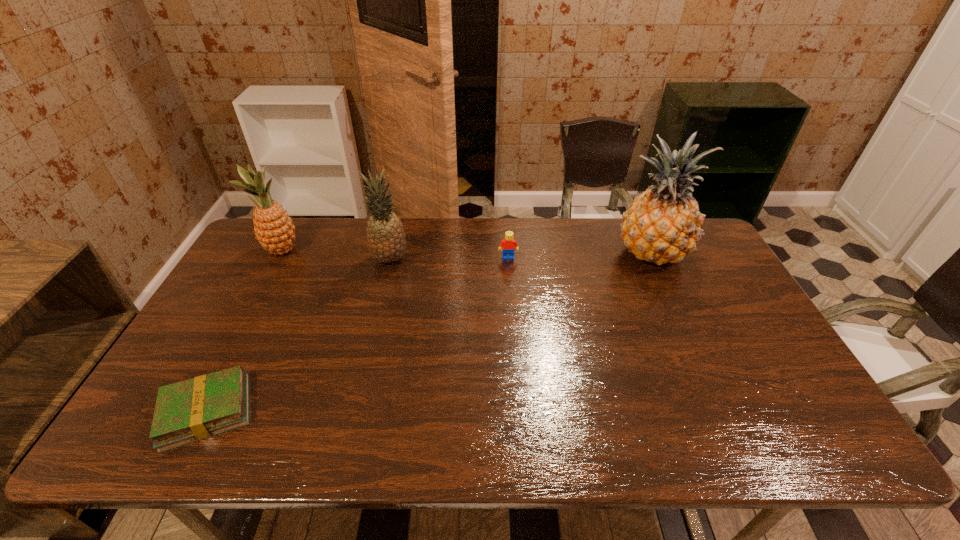
Locate an element on the screen. vacant space that is in between the fourth tallest object and the rightmost pineapple is located at coordinates (580, 255).

At what (x,y) coordinates should I click in order to perform the action: click on free point between the second pineapple from right to left and the nearest object. Please return your answer as a coordinate pair (x, y). Image resolution: width=960 pixels, height=540 pixels. Looking at the image, I should click on (299, 335).

The height and width of the screenshot is (540, 960). Identify the location of free space between the fourth tallest object and the second pineapple from left to right. (449, 258).

Identify the location of free point between the third object from right to left and the nearest object. The width and height of the screenshot is (960, 540). (299, 335).

Identify the location of free space between the shortest object and the leftmost pineapple. The image size is (960, 540). (245, 330).

The width and height of the screenshot is (960, 540). I want to click on vacant space that's between the book and the second shortest object, so click(357, 334).

This screenshot has height=540, width=960. Identify the location of object that is the closest one to the leftmost pineapple. (386, 239).

Identify which object is the fourth nearest to the nearest object. Please provide its 2D coordinates. Your answer should be formatted as a tuple, i.e. [(x, y)], where the tuple contains the x and y coordinates of a point satisfying the conditions above.

[(663, 224)]

The image size is (960, 540). Find the location of `pineapple that is the closest to the Lego`. pineapple that is the closest to the Lego is located at coordinates (386, 239).

The height and width of the screenshot is (540, 960). Identify the location of pineapple that is the second closest to the second pineapple from right to left. (663, 224).